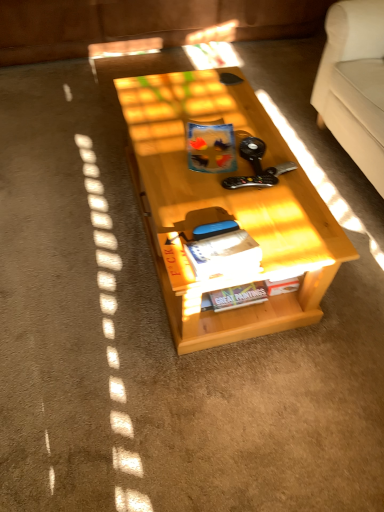
Question: Could hardcover book at center, which appears as the first book when viewed from the front, be considered to be inside matte plastic book at center, which ranks as the 1th book in top-to-bottom order?

Choices:
 (A) no
 (B) yes

Answer: (A)

Question: Does matte plastic book at center, which ranks as the second book in front-to-back order, touch hardcover book at center, which appears as the 2th book when viewed from the top?

Choices:
 (A) yes
 (B) no

Answer: (B)

Question: Is matte plastic book at center, which ranks as the 1th book in top-to-bottom order, bigger than hardcover book at center, marked as the 3th book in a back-to-front arrangement?

Choices:
 (A) yes
 (B) no

Answer: (A)

Question: Is matte plastic book at center, which is the second book in back-to-front order, positioned with its back to hardcover book at center, which is the second book from bottom to top?

Choices:
 (A) no
 (B) yes

Answer: (B)

Question: Does matte plastic book at center, placed as the 3th book when sorted from bottom to top, have a greater width compared to hardcover book at center, which appears as the first book when viewed from the front?

Choices:
 (A) yes
 (B) no

Answer: (A)

Question: Is matte plastic book at center, which is the second book in back-to-front order, in front of hardcover book at center, which is the second book from bottom to top?

Choices:
 (A) yes
 (B) no

Answer: (B)

Question: Does light wood table at center have a lesser height compared to matte paper magazine at center?

Choices:
 (A) no
 (B) yes

Answer: (A)

Question: Is light wood table at center at the right side of matte paper magazine at center?

Choices:
 (A) no
 (B) yes

Answer: (A)

Question: Considering the relative sizes of light wood table at center and matte paper magazine at center in the image provided, is light wood table at center taller than matte paper magazine at center?

Choices:
 (A) yes
 (B) no

Answer: (A)

Question: Could you tell me if light wood table at center is facing matte paper magazine at center?

Choices:
 (A) no
 (B) yes

Answer: (A)

Question: From the image's perspective, is light wood table at center over matte paper magazine at center?

Choices:
 (A) no
 (B) yes

Answer: (B)

Question: Is light wood table at center with matte paper magazine at center?

Choices:
 (A) yes
 (B) no

Answer: (B)

Question: Is matte paper magazine at center in contact with matte plastic book at center, placed as the 3th book when sorted from bottom to top?

Choices:
 (A) yes
 (B) no

Answer: (B)